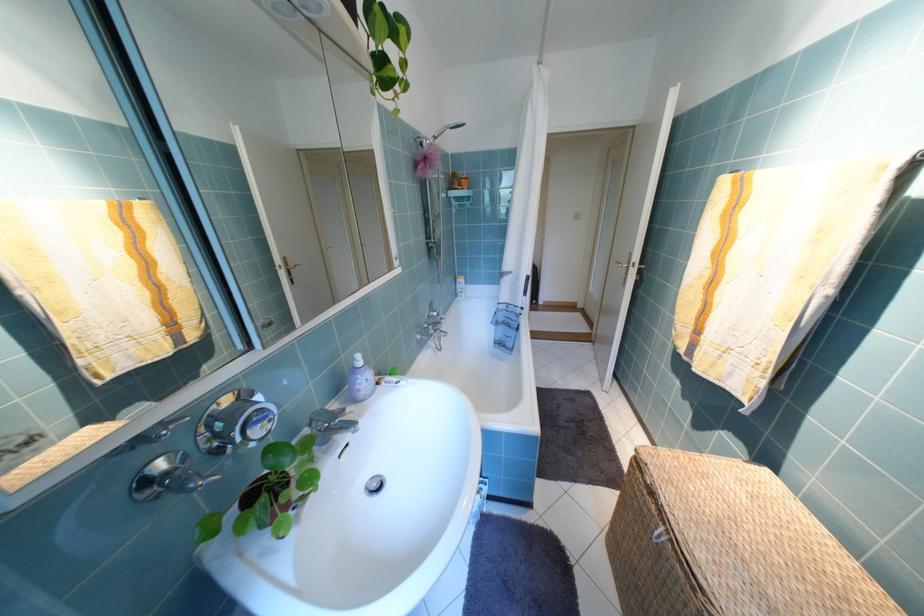
Where is `chrome faucet handle`? The width and height of the screenshot is (924, 616). chrome faucet handle is located at coordinates (323, 416).